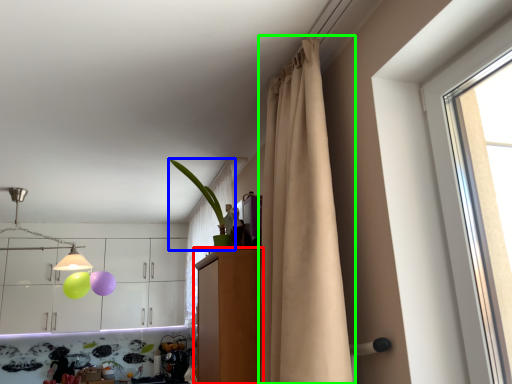
Question: Estimate the real-world distances between objects in this image. Which object is farther from dresser (highlighted by a red box), houseplant (highlighted by a blue box) or curtain (highlighted by a green box)?

Choices:
 (A) houseplant
 (B) curtain

Answer: (B)